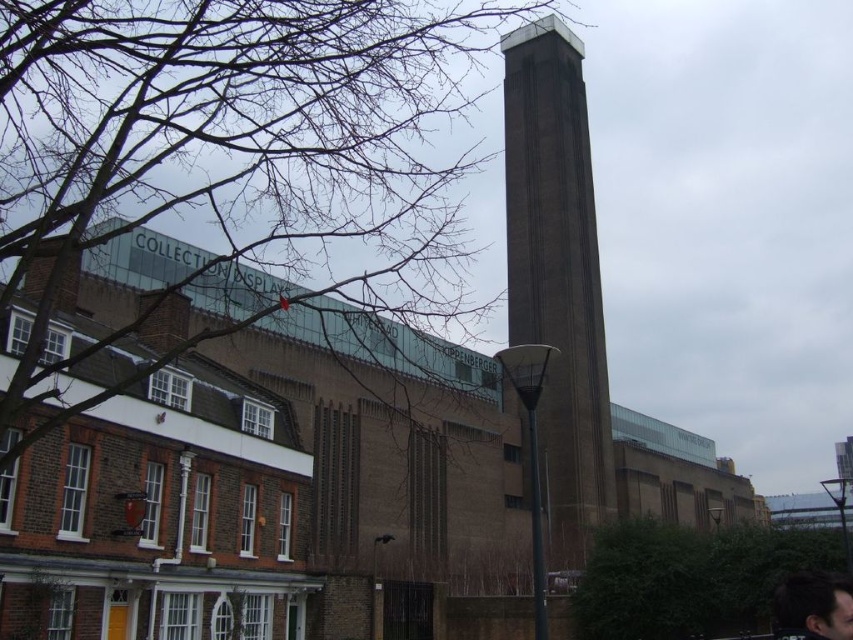
Which is behind, point (607, 396) or point (799, 608)?

Point (607, 396)

Between brown brick tower at center and dark brown hair at lower right, which one appears on the right side from the viewer's perspective?

From the viewer's perspective, brown brick tower at center appears more on the right side.

Is point (527, 166) positioned before point (840, 586)?

No, it is not.

This screenshot has height=640, width=853. I want to click on brown brick tower at center, so click(x=556, y=276).